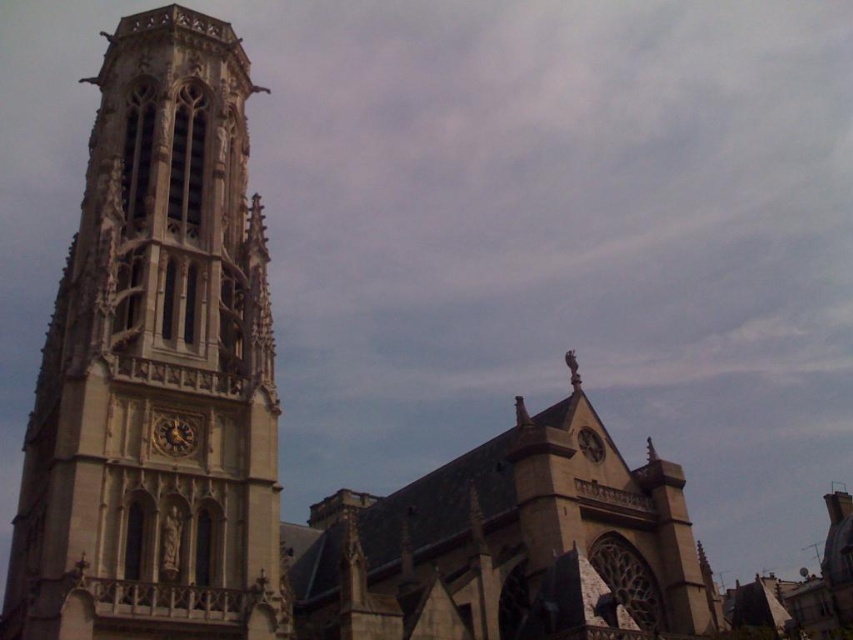
Measure the distance from gold metallic clock at center-left to golden polished clock at upper center.

A distance of 94.95 feet exists between gold metallic clock at center-left and golden polished clock at upper center.

Can you confirm if gold metallic clock at center-left is positioned above golden polished clock at upper center?

Yes, gold metallic clock at center-left is above golden polished clock at upper center.

Does point (180, 436) come behind point (579, 442)?

That is False.

This screenshot has height=640, width=853. What are the coordinates of `gold metallic clock at center-left` in the screenshot? It's located at (175, 435).

Locate an element on the screen. Image resolution: width=853 pixels, height=640 pixels. beige stone tower at left is located at coordinates (155, 368).

Does beige stone tower at left have a smaller size compared to golden polished clock at upper center?

No.

What are the coordinates of `beige stone tower at left` in the screenshot? It's located at coord(155,368).

Who is positioned more to the right, beige stone tower at left or gold metallic clock at center-left?

From the viewer's perspective, gold metallic clock at center-left appears more on the right side.

Is beige stone tower at left positioned at the back of gold metallic clock at center-left?

No.

Find the location of a particular element. This screenshot has height=640, width=853. beige stone tower at left is located at coordinates (155, 368).

Locate an element on the screen. The width and height of the screenshot is (853, 640). beige stone tower at left is located at coordinates (155, 368).